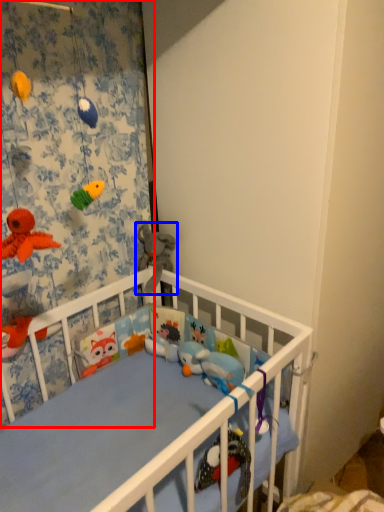
Question: Which object appears closest to the camera in this image, curtain (highlighted by a red box) or toy (highlighted by a blue box)?

Choices:
 (A) curtain
 (B) toy

Answer: (A)